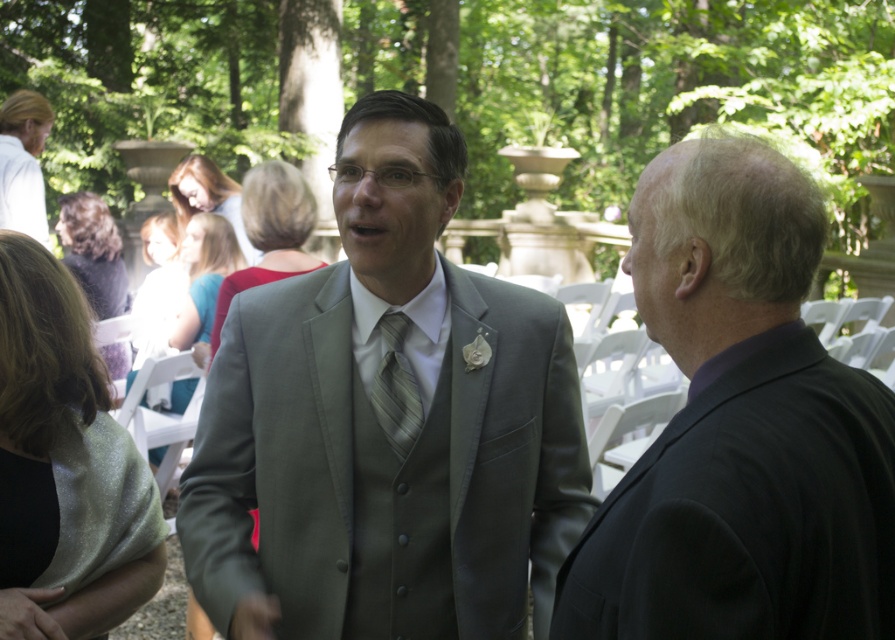
You are a photographer at the wedding reception and need to ensure both the matte gray suit at center and the striped silk tie at center are fully visible in the photo. Based on their positions, which object might require you to adjust your camera angle to capture its full view?

The matte gray suit at center might be wider than the striped silk tie at center, so adjusting the camera angle could help ensure the entire matte gray suit at center is visible.

You are a photographer at the wedding reception and need to capture a photo of both the dark purple suit at right and the striped silk tie at center. The camera you are using has a maximum focus range of 3 feet. Can you fit both subjects into the frame without moving the camera?

The dark purple suit at right and striped silk tie at center are 3.66 feet apart from each other. Since the camera has a maximum focus range of 3 feet, the distance between them exceeds this limit. Therefore, you cannot fit both subjects into the frame without moving the camera.